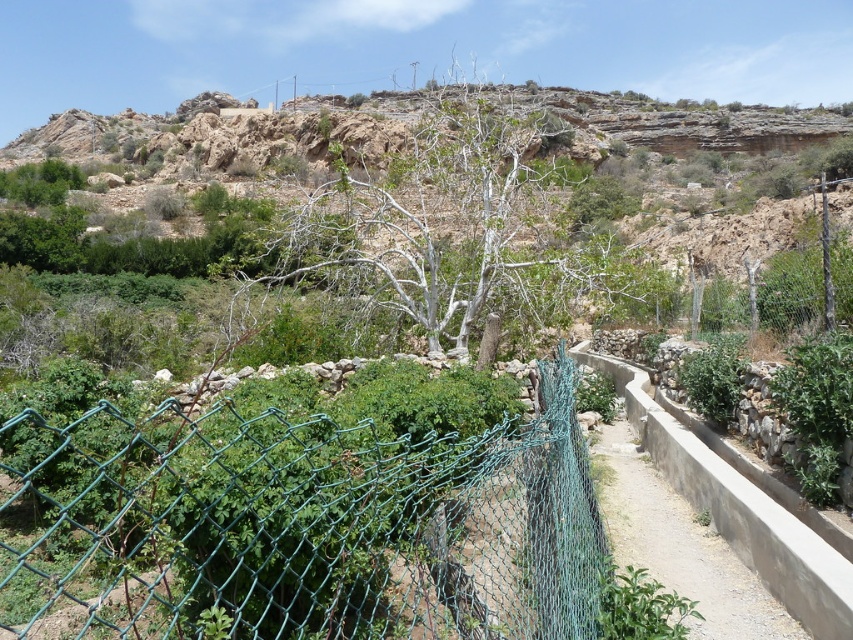
Who is lower down, green chain-link fence at center or gray concrete path at center?

gray concrete path at center is lower down.

What do you see at coordinates (297, 528) in the screenshot? The width and height of the screenshot is (853, 640). I see `green chain-link fence at center` at bounding box center [297, 528].

Between point (160, 540) and point (695, 589), which one is positioned in front?

Point (160, 540) is more forward.

Where is `green chain-link fence at center`? green chain-link fence at center is located at coordinates (297, 528).

Is green chain-link fence at center to the right of bare wood tree at center from the viewer's perspective?

Incorrect, green chain-link fence at center is not on the right side of bare wood tree at center.

Between green chain-link fence at center and bare wood tree at center, which one is positioned lower?

Positioned lower is green chain-link fence at center.

Which is behind, point (346, 605) or point (558, 204)?

The point (558, 204) is more distant.

I want to click on green chain-link fence at center, so click(297, 528).

Is point (436, 285) closer to viewer compared to point (602, 452)?

No.

Which is more to the left, bare wood tree at center or gray concrete path at center?

From the viewer's perspective, gray concrete path at center appears more on the left side.

Is point (363, 184) behind point (653, 572)?

That is True.

Find the location of `bare wood tree at center`. bare wood tree at center is located at coordinates (453, 227).